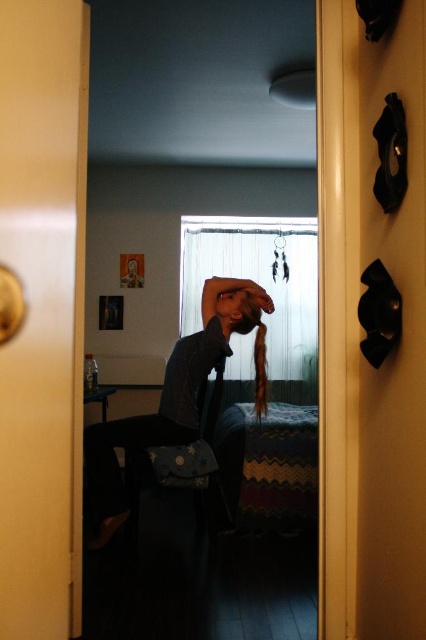
Is denim jacket at center above matte black hair at center?

Actually, denim jacket at center is below matte black hair at center.

Can you confirm if denim jacket at center is taller than matte black hair at center?

Indeed, denim jacket at center has a greater height compared to matte black hair at center.

Is point (178, 356) less distant than point (221, 284)?

No, it is not.

Where is `denim jacket at center`? The height and width of the screenshot is (640, 426). denim jacket at center is located at coordinates (173, 397).